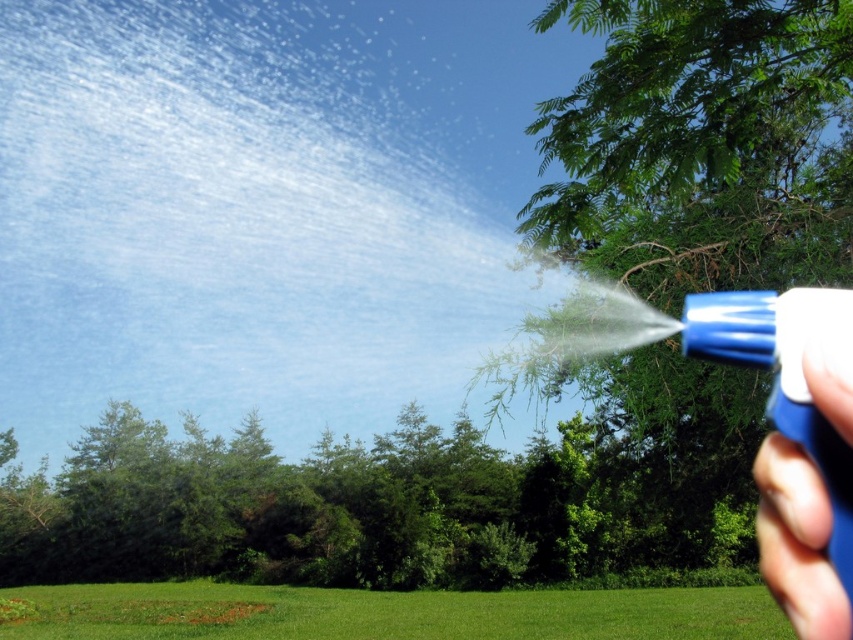
You are a gardener holding a blue plastic spray nozzle at lower right and want to water the green leafy tree at upper right. Considering their positions, can you reach the base of the tree with the spray nozzle without moving either object?

The green leafy tree at upper right might be wider than blue plastic spray nozzle at lower right, but the description does not provide information about the distance between them. Therefore, it is unclear if the spray nozzle can reach the base of the tree without moving either object.

You are a gardener holding a blue plastic spray nozzle at lower right and need to water the green leafy tree at upper right. Which direction should you move the nozzle to spray water towards the tree?

The green leafy tree at upper right is to the right of the blue plastic spray nozzle at lower right, so you should move the nozzle to the right to spray water towards the tree.